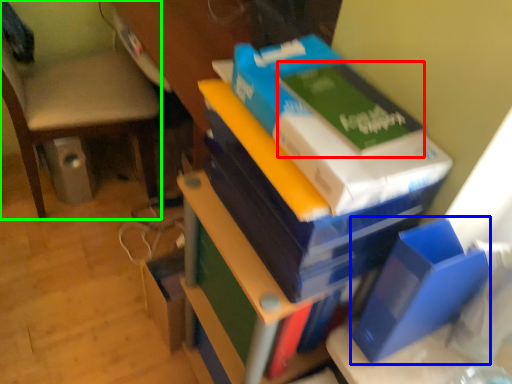
Question: Which object is positioned closest to paperback book (highlighted by a red box)? Select from paperback book (highlighted by a blue box) and chair (highlighted by a green box).

Choices:
 (A) paperback book
 (B) chair

Answer: (A)